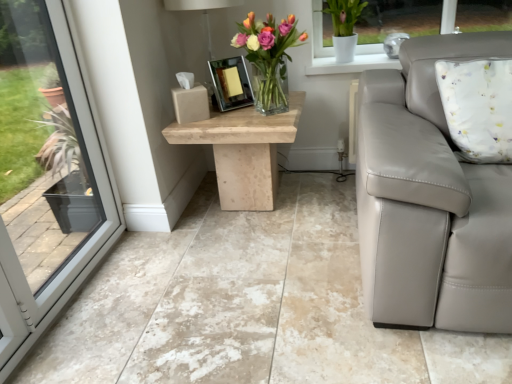
Where is `vacant region in front of natural stone table at center`? This screenshot has width=512, height=384. vacant region in front of natural stone table at center is located at coordinates tap(242, 261).